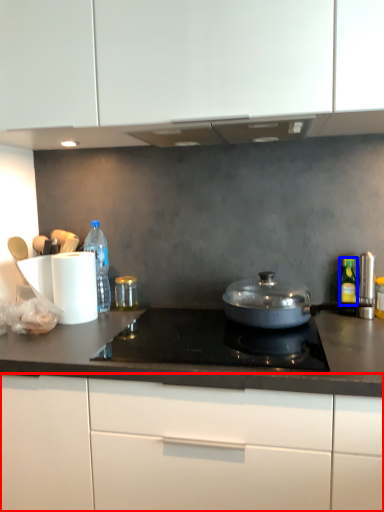
Question: Among these objects, which one is nearest to the camera, cabinetry (highlighted by a red box) or bottle (highlighted by a blue box)?

Choices:
 (A) cabinetry
 (B) bottle

Answer: (A)